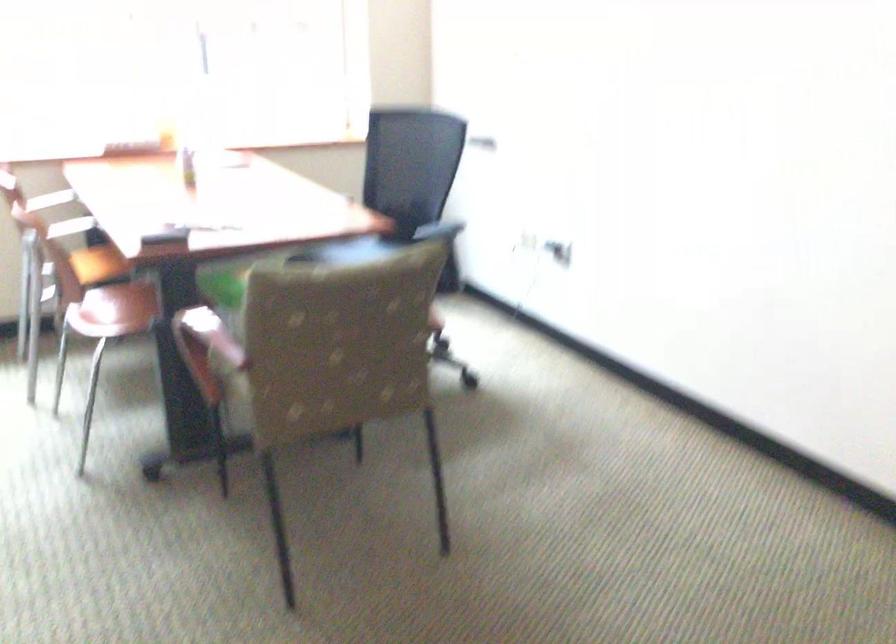
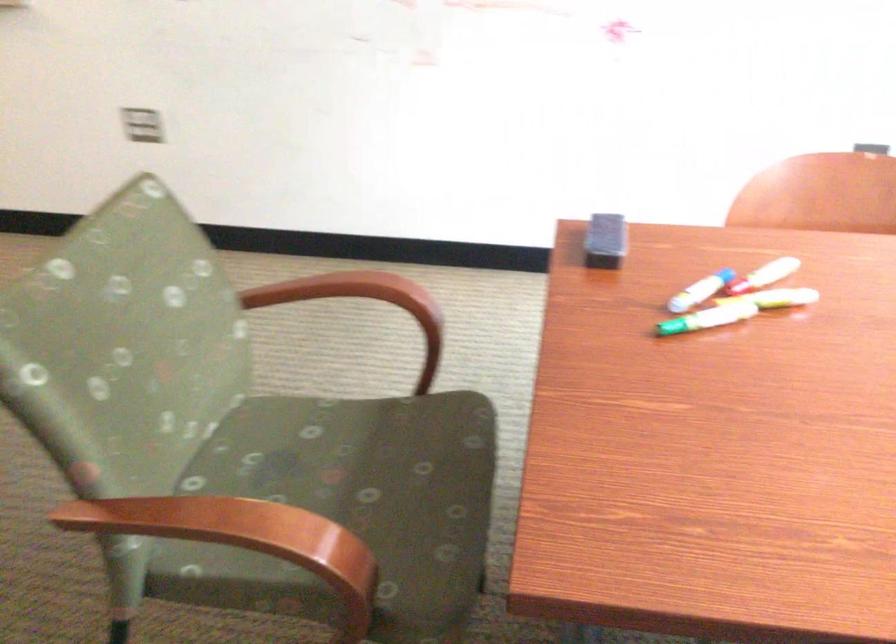
Locate, in the second image, the point that corresponds to (x=233, y=218) in the first image.

(675, 327)